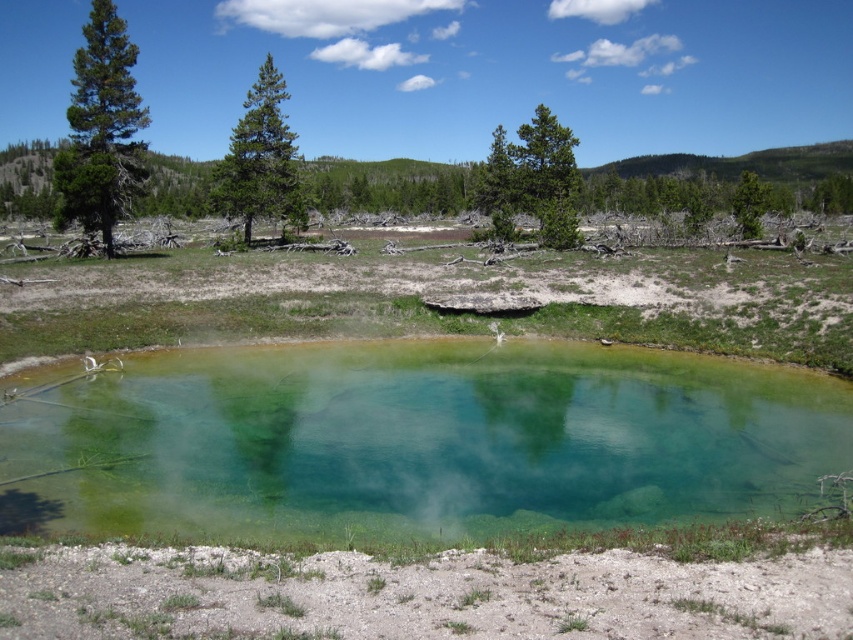
Question: Can you confirm if green translucent water at center is positioned below green pine tree at center?

Choices:
 (A) yes
 (B) no

Answer: (A)

Question: Is green translucent water at center positioned at the back of green matte tree at upper right?

Choices:
 (A) no
 (B) yes

Answer: (A)

Question: Which point appears closest to the camera in this image?

Choices:
 (A) pyautogui.click(x=291, y=216)
 (B) pyautogui.click(x=426, y=502)
 (C) pyautogui.click(x=111, y=22)
 (D) pyautogui.click(x=758, y=205)

Answer: (B)

Question: Which of the following is the farthest from the observer?

Choices:
 (A) (59, 180)
 (B) (283, 81)

Answer: (B)

Question: Which object is the closest to the green translucent water at center?

Choices:
 (A) green pine tree at left
 (B) green rough bark tree at upper center

Answer: (B)

Question: Is green pine tree at left positioned at the back of green pine tree at center?

Choices:
 (A) yes
 (B) no

Answer: (B)